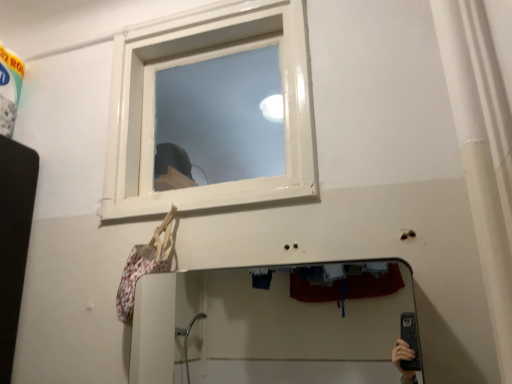
Question: Can you confirm if smooth glass mirror at lower center is bigger than white glossy window at upper center?

Choices:
 (A) no
 (B) yes

Answer: (A)

Question: Does smooth glass mirror at lower center come behind white glossy window at upper center?

Choices:
 (A) no
 (B) yes

Answer: (A)

Question: Is white glossy window at upper center a part of smooth glass mirror at lower center?

Choices:
 (A) no
 (B) yes

Answer: (A)

Question: Considering the relative sizes of smooth glass mirror at lower center and white glossy window at upper center in the image provided, is smooth glass mirror at lower center wider than white glossy window at upper center?

Choices:
 (A) no
 (B) yes

Answer: (A)

Question: Is smooth glass mirror at lower center positioned with its back to white glossy window at upper center?

Choices:
 (A) no
 (B) yes

Answer: (A)

Question: Considering the relative positions of smooth glass mirror at lower center and white glossy window at upper center in the image provided, is smooth glass mirror at lower center in front of white glossy window at upper center?

Choices:
 (A) no
 (B) yes

Answer: (B)

Question: Is white glossy window at upper center positioned far away from smooth glass mirror at lower center?

Choices:
 (A) yes
 (B) no

Answer: (A)

Question: From a real-world perspective, is white glossy window at upper center located higher than smooth glass mirror at lower center?

Choices:
 (A) yes
 (B) no

Answer: (A)

Question: Does white glossy window at upper center have a lesser width compared to smooth glass mirror at lower center?

Choices:
 (A) yes
 (B) no

Answer: (B)

Question: Is white glossy window at upper center smaller than smooth glass mirror at lower center?

Choices:
 (A) yes
 (B) no

Answer: (B)

Question: Does white glossy window at upper center turn towards smooth glass mirror at lower center?

Choices:
 (A) yes
 (B) no

Answer: (B)

Question: From the image's perspective, is white glossy window at upper center located beneath smooth glass mirror at lower center?

Choices:
 (A) yes
 (B) no

Answer: (B)

Question: Is white glossy window at upper center in front of or behind smooth glass mirror at lower center in the image?

Choices:
 (A) behind
 (B) front

Answer: (A)